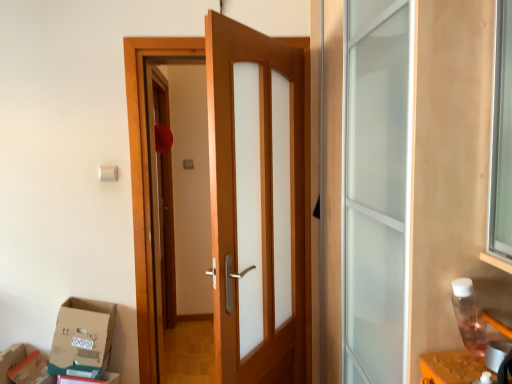
Where is `cardboard box at lower left, which is the 2th cardboard box from left to right`? The width and height of the screenshot is (512, 384). cardboard box at lower left, which is the 2th cardboard box from left to right is located at coordinates (82, 338).

Identify the location of cardboard box at lower left. (11, 360).

In terms of width, does wooden door at center look wider or thinner when compared to teal cardboard box at lower left, which appears as the 1th cardboard box when viewed from the left?

Considering their sizes, wooden door at center looks broader than teal cardboard box at lower left, which appears as the 1th cardboard box when viewed from the left.

Which point is more forward, (146, 251) or (8, 358)?

Positioned in front is point (8, 358).

In the image, is wooden door at center on the left side or the right side of teal cardboard box at lower left, which ranks as the 2th cardboard box in right-to-left order?

In the image, wooden door at center appears on the right side of teal cardboard box at lower left, which ranks as the 2th cardboard box in right-to-left order.

From the image's perspective, which is above, cardboard box at lower left, which is the 2th cardboard box from left to right, or wooden door at center?

From the image's view, wooden door at center is above.

Does cardboard box at lower left, which is the 2th cardboard box from left to right, touch wooden door at center?

No.

Is cardboard box at lower left, which is the 2th cardboard box from left to right, oriented towards wooden door at center?

No, cardboard box at lower left, which is the 2th cardboard box from left to right, is not aimed at wooden door at center.

Does cardboard box at lower left, the 1th cardboard box positioned from the right, have a lesser width compared to wooden door at center?

No.

Which object is positioned more to the left, wooden door at center or cardboard box at lower left?

Positioned to the left is cardboard box at lower left.

Considering the sizes of objects wooden door at center and cardboard box at lower left in the image provided, who is smaller, wooden door at center or cardboard box at lower left?

With smaller size is cardboard box at lower left.

Locate an element on the screen. This screenshot has height=384, width=512. door above the cardboard box at lower left (from the image's perspective) is located at coordinates (143, 158).

Are wooden door at center and cardboard box at lower left far apart?

No, wooden door at center is not far from cardboard box at lower left.

Looking at this image, is cardboard box at lower left not near wooden door at center?

No, cardboard box at lower left is not far from wooden door at center.

Is cardboard box at lower left at the left side of wooden door at center?

Yes.

From a real-world perspective, relative to wooden door at center, is cardboard box at lower left vertically above or below?

cardboard box at lower left is below wooden door at center.

Is cardboard box at lower left not inside wooden door at center?

That's correct, cardboard box at lower left is outside of wooden door at center.

Are cardboard box at lower left and cardboard box at lower left, which is the 2th cardboard box from left to right, beside each other?

No, cardboard box at lower left is not touching cardboard box at lower left, which is the 2th cardboard box from left to right.

Is point (7, 376) positioned behind point (72, 306)?

That is True.

Is cardboard box at lower left bigger than cardboard box at lower left, which is the 2th cardboard box from left to right?

No.

From a real-world perspective, which object stands above the other?

cardboard box at lower left, the 1th cardboard box positioned from the right, from a real-world perspective.

Which is further, (137, 153) or (104, 343)?

The point (137, 153) is more distant.

Can you confirm if wooden door at center is taller than cardboard box at lower left, the 1th cardboard box positioned from the right?

Yes.

You are a GUI agent. You are given a task and a screenshot of the screen. Output one action in this format:
    pyautogui.click(x=<x>, y=<y>)
    Task: Click on the door to the right of cardboard box at lower left, which is the 2th cardboard box from left to right
    This screenshot has width=512, height=384.
    Given the screenshot: What is the action you would take?
    pyautogui.click(x=143, y=158)

Does wooden door at center lie behind cardboard box at lower left, the 1th cardboard box positioned from the right?

Yes.

From the image's perspective, which is below, cardboard box at lower left, which is the 2th cardboard box from left to right, or cardboard box at lower left?

cardboard box at lower left is shown below in the image.

At what (x,y) coordinates should I click in order to perform the action: click on box below the cardboard box at lower left, the 1th cardboard box positioned from the right (from a real-world perspective). Please return your answer as a coordinate pair (x, y). Looking at the image, I should click on (11, 360).

From a real-world perspective, which is physically above, cardboard box at lower left, which is the 2th cardboard box from left to right, or cardboard box at lower left?

cardboard box at lower left, which is the 2th cardboard box from left to right.

Identify the location of the 2nd cardboard box below when counting from the wooden door at center (from the image's perspective). (22, 365).

Image resolution: width=512 pixels, height=384 pixels. There is a wooden door at center. What are the coordinates of `the 1st cardboard box below it (from a real-world perspective)` in the screenshot? It's located at (82, 338).

Based on their spatial positions, is teal cardboard box at lower left, which ranks as the 2th cardboard box in right-to-left order, or cardboard box at lower left, the 1th cardboard box positioned from the right, further from wooden door at center?

teal cardboard box at lower left, which ranks as the 2th cardboard box in right-to-left order, is further to wooden door at center.

Estimate the real-world distances between objects in this image. Which object is closer to cardboard box at lower left, which is the 2th cardboard box from left to right, wooden door at center or cardboard box at lower left?

cardboard box at lower left lies closer to cardboard box at lower left, which is the 2th cardboard box from left to right, than the other object.

Which object lies further to the anchor point cardboard box at lower left, wooden door at center or teal cardboard box at lower left, which ranks as the 2th cardboard box in right-to-left order?

Based on the image, wooden door at center appears to be further to cardboard box at lower left.

Based on their spatial positions, is teal cardboard box at lower left, which appears as the 1th cardboard box when viewed from the left, or wooden door at center closer to cardboard box at lower left, the 1th cardboard box positioned from the right?

teal cardboard box at lower left, which appears as the 1th cardboard box when viewed from the left, is closer to cardboard box at lower left, the 1th cardboard box positioned from the right.

Considering their positions, is teal cardboard box at lower left, which appears as the 1th cardboard box when viewed from the left, positioned further to cardboard box at lower left, which is the 2th cardboard box from left to right, than cardboard box at lower left?

cardboard box at lower left.

Considering their positions, is cardboard box at lower left, the 1th cardboard box positioned from the right, positioned closer to wooden door at center than teal cardboard box at lower left, which ranks as the 2th cardboard box in right-to-left order?

cardboard box at lower left, the 1th cardboard box positioned from the right.

When comparing their distances from teal cardboard box at lower left, which ranks as the 2th cardboard box in right-to-left order, does wooden door at center or cardboard box at lower left seem further?

Among the two, wooden door at center is located further to teal cardboard box at lower left, which ranks as the 2th cardboard box in right-to-left order.

Based on their spatial positions, is cardboard box at lower left, which is the 2th cardboard box from left to right, or wooden door at center further from teal cardboard box at lower left, which appears as the 1th cardboard box when viewed from the left?

Among the two, wooden door at center is located further to teal cardboard box at lower left, which appears as the 1th cardboard box when viewed from the left.

In order to click on cardboard box between teal cardboard box at lower left, which appears as the 1th cardboard box when viewed from the left, and wooden door at center from left to right in this screenshot , I will do `click(82, 338)`.

What are the coordinates of `cardboard box between cardboard box at lower left and cardboard box at lower left, which is the 2th cardboard box from left to right, from left to right` in the screenshot? It's located at (22, 365).